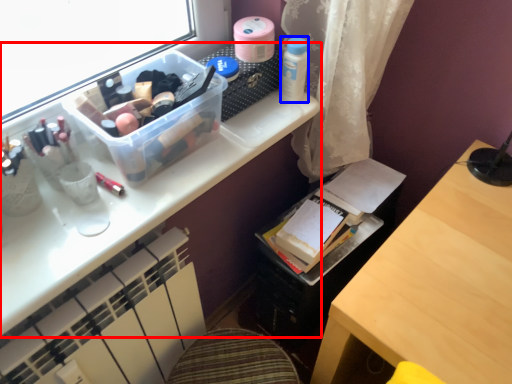
Question: Which object is closer to the camera taking this photo, desk (highlighted by a red box) or toiletry (highlighted by a blue box)?

Choices:
 (A) desk
 (B) toiletry

Answer: (A)